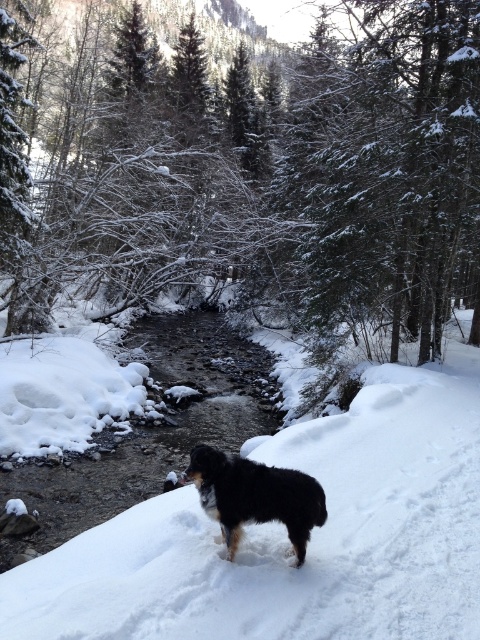
Is white fluffy snow at center shorter than black fur dog at center?

Incorrect, white fluffy snow at center's height does not fall short of black fur dog at center's.

Is white fluffy snow at center to the left of black fur dog at center from the viewer's perspective?

No, white fluffy snow at center is not to the left of black fur dog at center.

Is point (338, 516) positioned in front of point (222, 458)?

No, it is behind (222, 458).

You are a GUI agent. You are given a task and a screenshot of the screen. Output one action in this format:
    pyautogui.click(x=<x>, y=<y>)
    Task: Click on the white fluffy snow at center
    This screenshot has height=640, width=480.
    Given the screenshot: What is the action you would take?
    pyautogui.click(x=287, y=540)

Is point (403, 262) in front of point (216, 474)?

No, (403, 262) is further to viewer.

Can you confirm if snow-covered evergreen tree at center is bigger than black fur dog at center?

Correct, snow-covered evergreen tree at center is larger in size than black fur dog at center.

Measure the distance between snow-covered evergreen tree at center and camera.

snow-covered evergreen tree at center is 39.06 feet away from camera.

Locate an element on the screen. The height and width of the screenshot is (640, 480). snow-covered evergreen tree at center is located at coordinates (245, 164).

Is snow-covered evergreen tree at center positioned before white fluffy snow at center?

No, it is behind white fluffy snow at center.

Is point (38, 280) in front of point (440, 394)?

No, (38, 280) is behind (440, 394).

The width and height of the screenshot is (480, 640). What do you see at coordinates (245, 164) in the screenshot?
I see `snow-covered evergreen tree at center` at bounding box center [245, 164].

Locate an element on the screen. This screenshot has height=640, width=480. snow-covered evergreen tree at center is located at coordinates (245, 164).